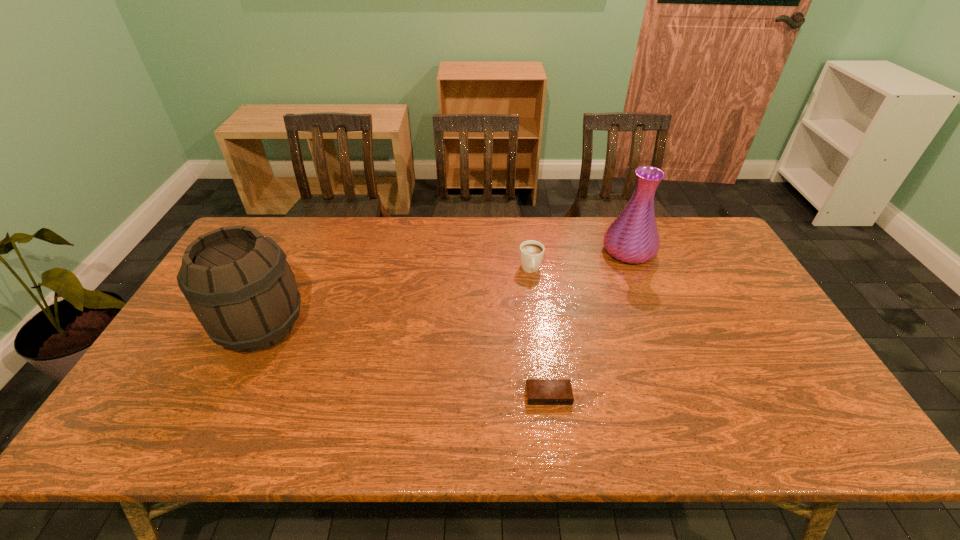
Locate an element on the screen. The image size is (960, 540). vase that is positioned at the far edge is located at coordinates (633, 237).

Where is `cappuccino positioned at the far edge`? The height and width of the screenshot is (540, 960). cappuccino positioned at the far edge is located at coordinates (531, 252).

Find the location of a particular element. The height and width of the screenshot is (540, 960). object that is positioned at the left edge is located at coordinates (237, 281).

In the image, there is a desktop. Where is `vacant space at the far edge`? This screenshot has width=960, height=540. vacant space at the far edge is located at coordinates (459, 258).

Where is `vacant region at the near edge of the desktop`? This screenshot has width=960, height=540. vacant region at the near edge of the desktop is located at coordinates tap(268, 434).

Locate an element on the screen. free space at the left edge is located at coordinates (200, 368).

The width and height of the screenshot is (960, 540). Identify the location of free location at the right edge. (793, 350).

At what (x,y) coordinates should I click in order to perform the action: click on free space at the far left corner. Please return your answer as a coordinate pair (x, y). Image resolution: width=960 pixels, height=540 pixels. Looking at the image, I should click on [x=287, y=239].

The width and height of the screenshot is (960, 540). In the image, there is a desktop. Identify the location of vacant area at the near right corner. (795, 431).

At what (x,y) coordinates should I click in order to perform the action: click on free spot between the wine bucket and the alarm clock. Please return your answer as a coordinate pair (x, y). This screenshot has height=540, width=960. Looking at the image, I should click on (405, 361).